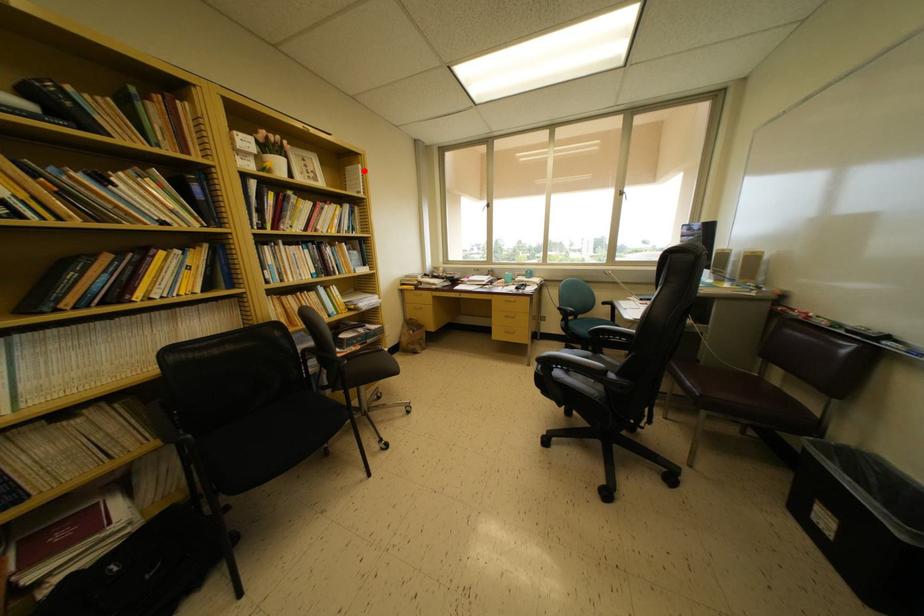
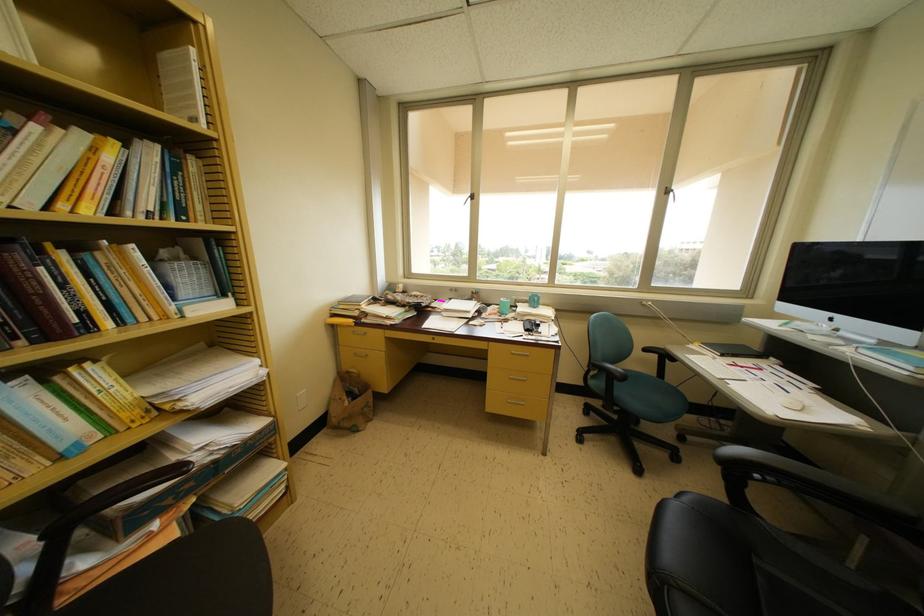
Question: A red point is marked in image1. In image2, is the corresponding 3D point closer to the camera or farther? Reply with the corresponding letter.

Choices:
 (A) The corresponding 3D point is closer.
 (B) The corresponding 3D point is farther.

Answer: (B)